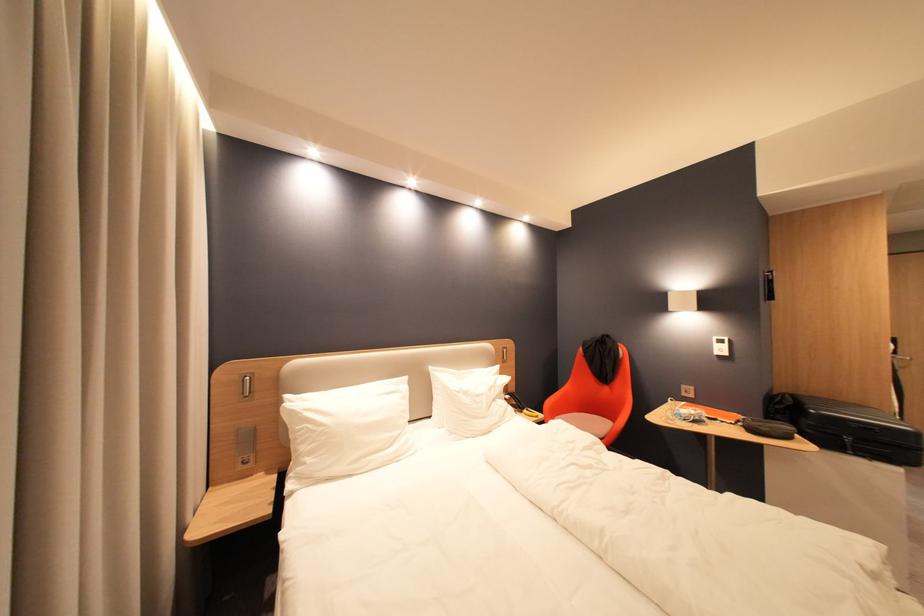
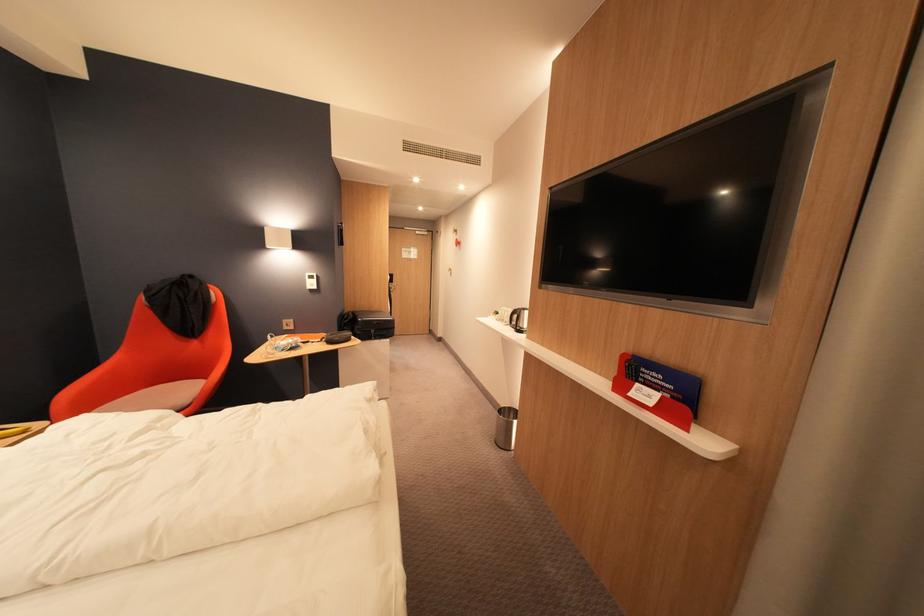
Question: The camera is either moving clockwise (left) or counter-clockwise (right) around the object. The first image is from the beginning of the video and the second image is from the end. Is the camera moving left or right when shooting the video?

Choices:
 (A) Left
 (B) Right

Answer: (A)